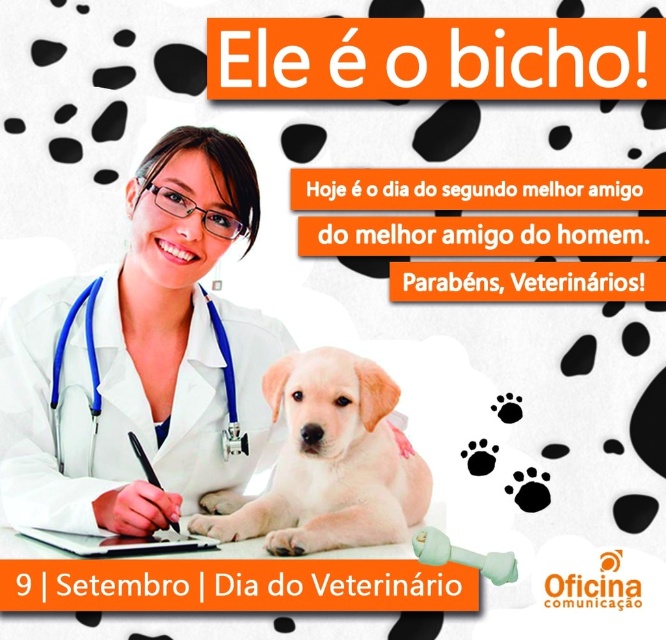
Is point (328, 365) closer to viewer compared to point (65, 330)?

That is True.

Where is `light brown fur puppy at center`? The width and height of the screenshot is (666, 640). light brown fur puppy at center is located at coordinates (330, 461).

Does white lab coat at center come behind blue fabric stethoscope at lower left?

No, white lab coat at center is in front of blue fabric stethoscope at lower left.

Can you confirm if white lab coat at center is taller than blue fabric stethoscope at lower left?

Yes.

Locate an element on the screen. Image resolution: width=666 pixels, height=640 pixels. white lab coat at center is located at coordinates click(x=141, y=358).

Is white lab coat at center behind light brown fur puppy at center?

Yes, it is.

Can you confirm if white lab coat at center is positioned to the left of light brown fur puppy at center?

Yes, white lab coat at center is to the left of light brown fur puppy at center.

Between point (143, 300) and point (296, 413), which one is positioned behind?

Positioned behind is point (143, 300).

Locate an element on the screen. white lab coat at center is located at coordinates (141, 358).